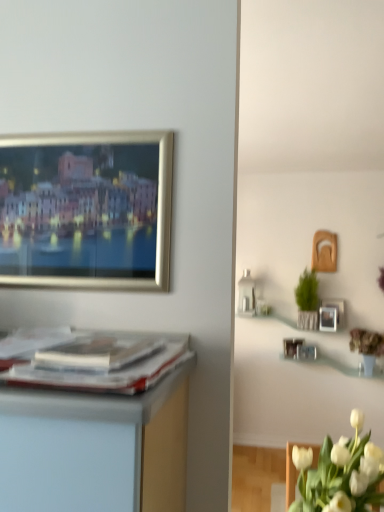
Measure the distance between green woven basket at upper right and camera.

The distance of green woven basket at upper right from camera is 3.94 meters.

The width and height of the screenshot is (384, 512). What do you see at coordinates (340, 473) in the screenshot? I see `white matte tulip at lower right` at bounding box center [340, 473].

What do you see at coordinates (98, 353) in the screenshot? I see `matte paper magazine at center` at bounding box center [98, 353].

This screenshot has height=512, width=384. In order to click on matte silver picture frame at upper right in this screenshot , I will do `click(332, 315)`.

Is green woven basket at upper right wider or thinner than white matte tulip at lower right?

In the image, green woven basket at upper right appears to be more narrow than white matte tulip at lower right.

Who is smaller, green woven basket at upper right or white matte tulip at lower right?

green woven basket at upper right is smaller.

Is point (310, 291) closer or farther from the camera than point (339, 501)?

Point (310, 291) is farther from the camera than point (339, 501).

What's the angular difference between green woven basket at upper right and white matte tulip at lower right's facing directions?

The angle between the facing direction of green woven basket at upper right and the facing direction of white matte tulip at lower right is 93.2 degrees.

Is white matte tulip at lower right aimed at green woven basket at upper right?

No, white matte tulip at lower right is not aimed at green woven basket at upper right.

Between point (380, 449) and point (307, 285), which one is positioned in front?

Positioned in front is point (380, 449).

Are white matte tulip at lower right and green woven basket at upper right located far from each other?

Indeed, white matte tulip at lower right is not near green woven basket at upper right.

From the image's perspective, between white matte tulip at lower right and green woven basket at upper right, which one is located above?

green woven basket at upper right is shown above in the image.

Are matte paper magazine at center and green woven basket at upper right beside each other?

No, matte paper magazine at center is not in contact with green woven basket at upper right.

Considering the relative sizes of matte paper magazine at center and green woven basket at upper right in the image provided, is matte paper magazine at center thinner than green woven basket at upper right?

Yes.

Who is smaller, matte paper magazine at center or green woven basket at upper right?

Smaller between the two is matte paper magazine at center.

Could you tell me if matte paper magazine at center is facing green woven basket at upper right?

No, matte paper magazine at center is not aimed at green woven basket at upper right.

From a real-world perspective, which is physically below, green woven basket at upper right or matte silver picture frame at upper right?

matte silver picture frame at upper right is physically lower.

Consider the image. Considering the relative positions of green woven basket at upper right and matte silver picture frame at upper right in the image provided, is green woven basket at upper right in front of matte silver picture frame at upper right?

Yes, green woven basket at upper right is in front of matte silver picture frame at upper right.

Between green woven basket at upper right and matte silver picture frame at upper right, which one has larger size?

green woven basket at upper right is bigger.

Is matte paper magazine at center wider or thinner than matte silver picture frame at upper right?

matte paper magazine at center is wider than matte silver picture frame at upper right.

Which is closer to the camera, (132, 352) or (330, 313)?

The point (132, 352) is closer to the camera.

Considering the relative positions of matte paper magazine at center and matte silver picture frame at upper right in the image provided, is matte paper magazine at center to the right of matte silver picture frame at upper right from the viewer's perspective?

No.

Who is taller, matte paper magazine at center or matte silver picture frame at upper right?

matte silver picture frame at upper right is taller.

Considering the relative sizes of white matte tulip at lower right and matte paper magazine at center in the image provided, is white matte tulip at lower right taller than matte paper magazine at center?

Yes, white matte tulip at lower right is taller than matte paper magazine at center.

Which point is more forward, (353, 411) or (145, 351)?

The point (145, 351) is closer to the camera.

From a real-world perspective, which is physically above, white matte tulip at lower right or matte paper magazine at center?

matte paper magazine at center is physically above.

Is white matte tulip at lower right located outside matte paper magazine at center?

Yes, white matte tulip at lower right is not within matte paper magazine at center.

Would you say matte silver picture frame at upper right is outside white matte tulip at lower right?

Yes.

From a real-world perspective, is matte silver picture frame at upper right physically located above or below white matte tulip at lower right?

Answer: matte silver picture frame at upper right is above white matte tulip at lower right.

Measure the distance between matte silver picture frame at upper right and white matte tulip at lower right.

matte silver picture frame at upper right is 8.45 feet from white matte tulip at lower right.

Which of these two, matte silver picture frame at upper right or white matte tulip at lower right, is wider?

Wider between the two is white matte tulip at lower right.

Where is `houseplant on the right side of white matte tulip at lower right`? The image size is (384, 512). houseplant on the right side of white matte tulip at lower right is located at coordinates (307, 300).

At what (x,y) coordinates should I click in order to perform the action: click on houseplant behind the white matte tulip at lower right. Please return your answer as a coordinate pair (x, y). This screenshot has height=512, width=384. Looking at the image, I should click on (307, 300).

Considering their positions, is green woven basket at upper right positioned closer to white matte tulip at lower right than matte silver picture frame at upper right?

green woven basket at upper right lies closer to white matte tulip at lower right than the other object.

Which object lies nearer to the anchor point matte silver picture frame at upper right, white matte tulip at lower right or green woven basket at upper right?

The object closer to matte silver picture frame at upper right is green woven basket at upper right.

Based on their spatial positions, is matte paper magazine at center or matte silver picture frame at upper right further from green woven basket at upper right?

The object further to green woven basket at upper right is matte paper magazine at center.

Estimate the real-world distances between objects in this image. Which object is further from matte paper magazine at center, matte silver picture frame at upper right or white matte tulip at lower right?

Based on the image, matte silver picture frame at upper right appears to be further to matte paper magazine at center.

Looking at the image, which one is located further to matte paper magazine at center, matte silver picture frame at upper right or green woven basket at upper right?

matte silver picture frame at upper right.

Based on their spatial positions, is green woven basket at upper right or matte paper magazine at center closer to white matte tulip at lower right?

The object closer to white matte tulip at lower right is matte paper magazine at center.

Looking at the image, which one is located closer to matte paper magazine at center, white matte tulip at lower right or matte silver picture frame at upper right?

Among the two, white matte tulip at lower right is located nearer to matte paper magazine at center.

Considering their positions, is matte silver picture frame at upper right positioned further to green woven basket at upper right than white matte tulip at lower right?

Among the two, white matte tulip at lower right is located further to green woven basket at upper right.

At what (x,y) coordinates should I click in order to perform the action: click on flower between matte paper magazine at center and green woven basket at upper right along the z-axis. Please return your answer as a coordinate pair (x, y). The width and height of the screenshot is (384, 512). Looking at the image, I should click on (340, 473).

You are a GUI agent. You are given a task and a screenshot of the screen. Output one action in this format:
    pyautogui.click(x=<x>, y=<y>)
    Task: Click on the flower between matte paper magazine at center and matte silver picture frame at upper right in the front-back direction
    
    Given the screenshot: What is the action you would take?
    pyautogui.click(x=340, y=473)

Locate an element on the screen. The height and width of the screenshot is (512, 384). houseplant located between matte paper magazine at center and matte silver picture frame at upper right in the depth direction is located at coordinates (307, 300).

This screenshot has height=512, width=384. I want to click on houseplant between white matte tulip at lower right and matte silver picture frame at upper right along the z-axis, so click(x=307, y=300).